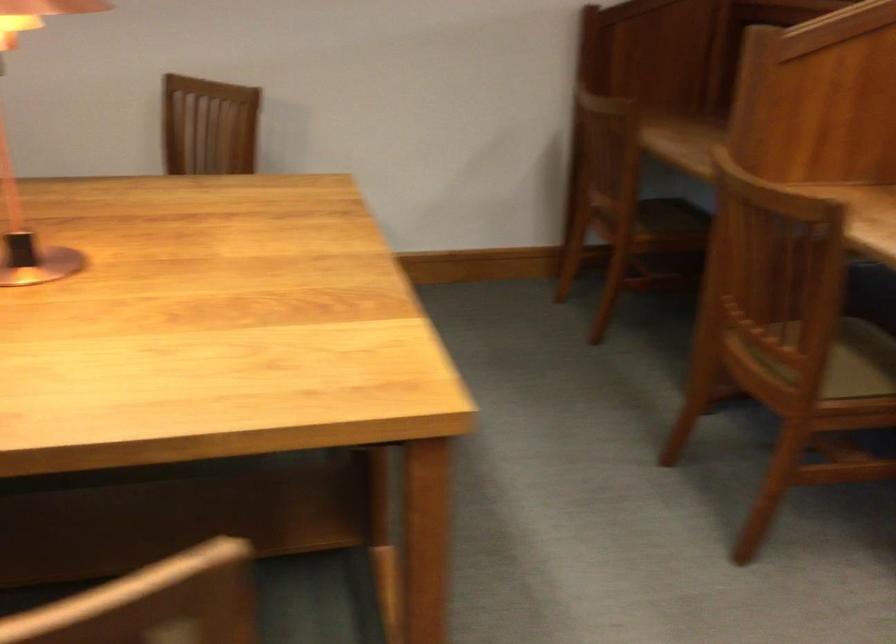
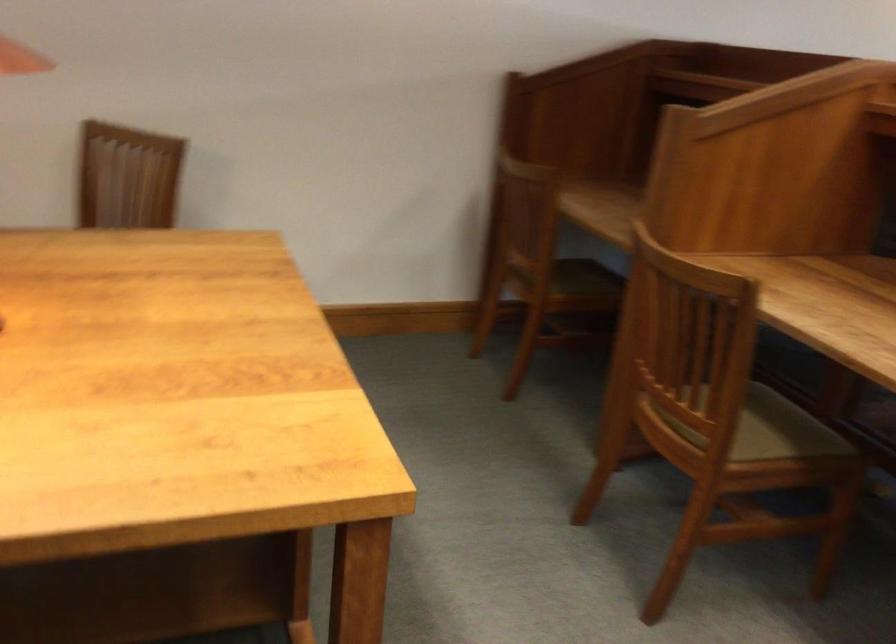
Where in the second image is the point corresponding to the point at 657,214 from the first image?

(572, 277)